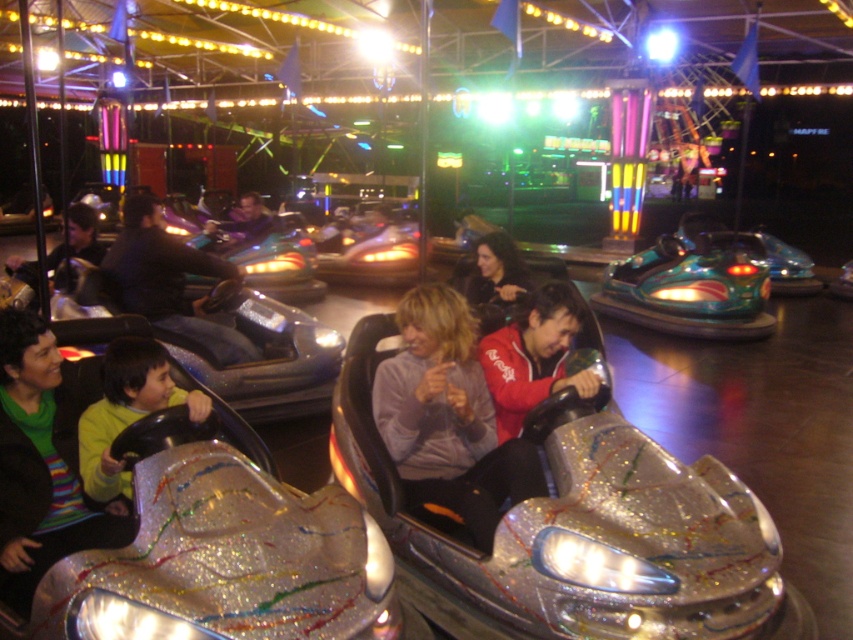
Can you confirm if green striped sweater at lower left is taller than matte black jacket at left?

Indeed, green striped sweater at lower left has a greater height compared to matte black jacket at left.

Does green striped sweater at lower left have a lesser width compared to matte black jacket at left?

No, green striped sweater at lower left is not thinner than matte black jacket at left.

Is point (86, 532) farther from camera compared to point (25, 268)?

No, (86, 532) is closer to viewer.

The height and width of the screenshot is (640, 853). Find the location of `green striped sweater at lower left`. green striped sweater at lower left is located at coordinates click(44, 460).

Does green striped sweater at lower left lie in front of shiny black hair at center?

Yes, it is in front of shiny black hair at center.

Who is more forward, (44, 422) or (503, 316)?

Point (44, 422) is more forward.

Between point (9, 484) and point (497, 317), which one is positioned behind?

The point (497, 317) is more distant.

Where is `green striped sweater at lower left`? The height and width of the screenshot is (640, 853). green striped sweater at lower left is located at coordinates (44, 460).

Is point (578, 330) farther from camera compared to point (91, 232)?

That is False.

How much distance is there between red fleece jacket at center and matte black jacket at left?

13.44 feet

Does point (537, 337) come farther from viewer compared to point (74, 224)?

No, it is not.

The height and width of the screenshot is (640, 853). In order to click on red fleece jacket at center in this screenshot , I will do `click(534, 356)`.